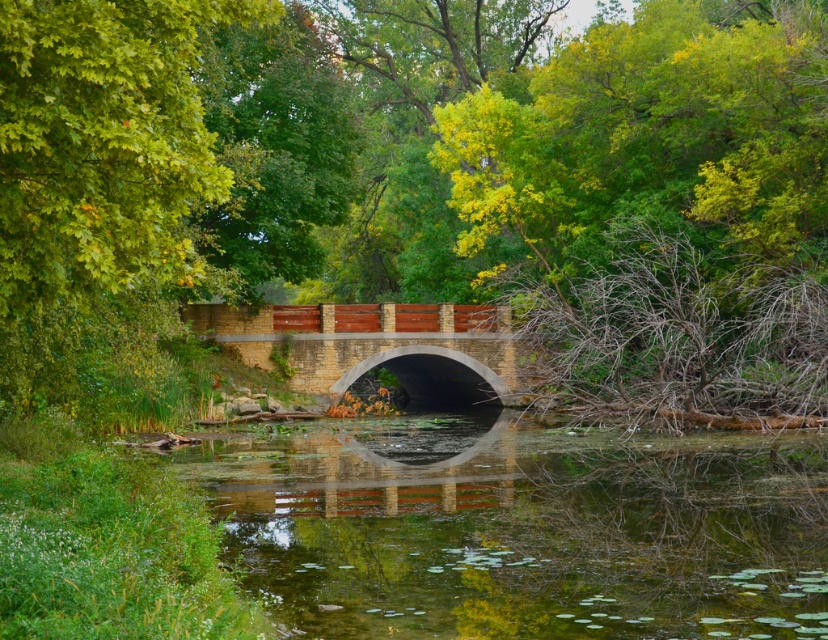
Who is taller, green reflective water at center or green leafy tree at left?

green leafy tree at left

The width and height of the screenshot is (828, 640). What do you see at coordinates (520, 529) in the screenshot?
I see `green reflective water at center` at bounding box center [520, 529].

Identify the location of green reflective water at center. (520, 529).

Is green leafy tree at left thinner than brick stone bridge at center?

Yes, green leafy tree at left is thinner than brick stone bridge at center.

Who is positioned more to the right, green leafy tree at left or brick stone bridge at center?

brick stone bridge at center is more to the right.

Is point (5, 193) farther from camera compared to point (326, 376)?

No.

This screenshot has width=828, height=640. I want to click on green leafy tree at left, so click(x=100, y=192).

Identify the location of green reflective water at center. The image size is (828, 640). (520, 529).